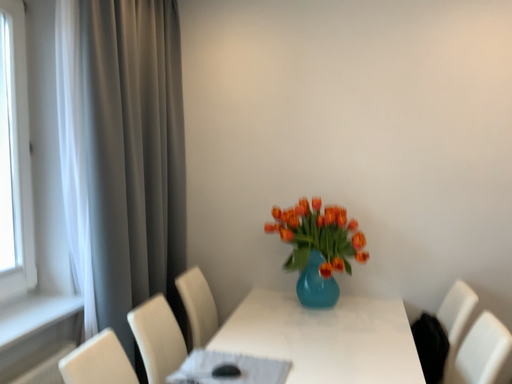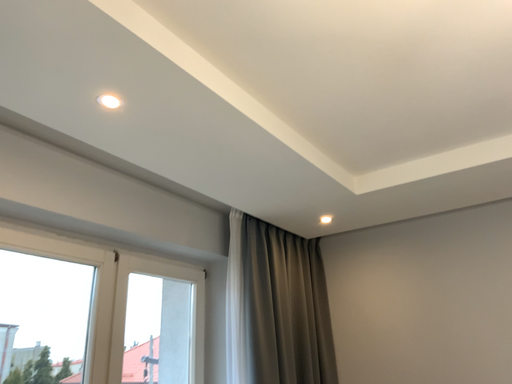
Question: Which way did the camera rotate in the video?

Choices:
 (A) rotated upward
 (B) rotated downward

Answer: (A)